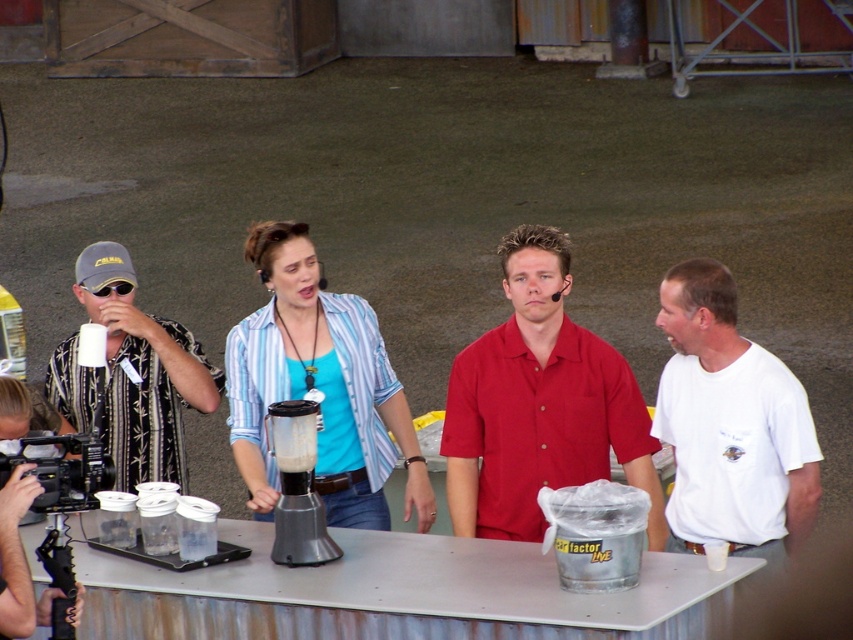
Does point (595, 460) come in front of point (367, 323)?

Yes, it is.

You are a GUI agent. You are given a task and a screenshot of the screen. Output one action in this format:
    pyautogui.click(x=<x>, y=<y>)
    Task: Click on the red matte shirt at center
    The image size is (853, 640).
    Given the screenshot: What is the action you would take?
    pyautogui.click(x=538, y=404)

Find the location of a particular element. This screenshot has height=640, width=853. red matte shirt at center is located at coordinates (538, 404).

Who is positioned more to the left, red matte shirt at center or white cotton t-shirt at right?

red matte shirt at center

Locate an element on the screen. red matte shirt at center is located at coordinates [538, 404].

Does blue striped shirt at center appear on the right side of white cotton t-shirt at right?

Incorrect, blue striped shirt at center is not on the right side of white cotton t-shirt at right.

Which of these two, blue striped shirt at center or white cotton t-shirt at right, stands taller?

Standing taller between the two is blue striped shirt at center.

Locate an element on the screen. The width and height of the screenshot is (853, 640). blue striped shirt at center is located at coordinates (318, 387).